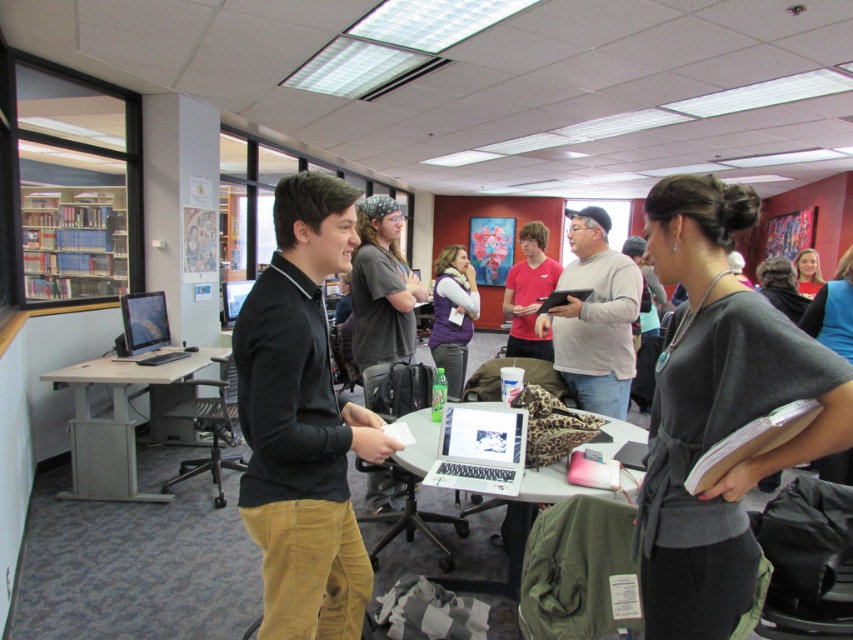
You are a librarian who needs to retrieve a book from the shelf. You see the matte purple vest at center and the matte black laptop at left. Which object is closer to the floor?

The matte purple vest at center is located below the matte black laptop at left, so it is closer to the floor.

Looking at this image, you are standing in the library and need to locate the wooden bookshelf at left. According to the coordinates provided, where should you look to find it?

The wooden bookshelf at left is located at coordinates point (74, 236).